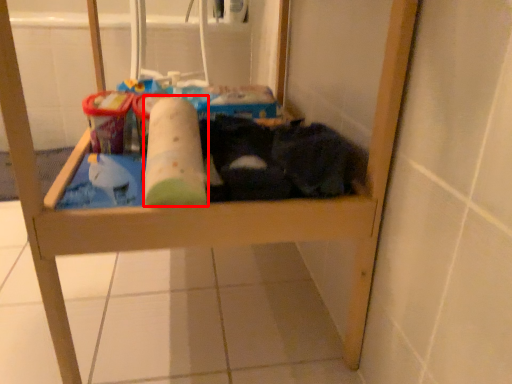
Question: From the image's perspective, where is toilet paper (annotated by the red box) located relative to laundry?

Choices:
 (A) below
 (B) above

Answer: (A)